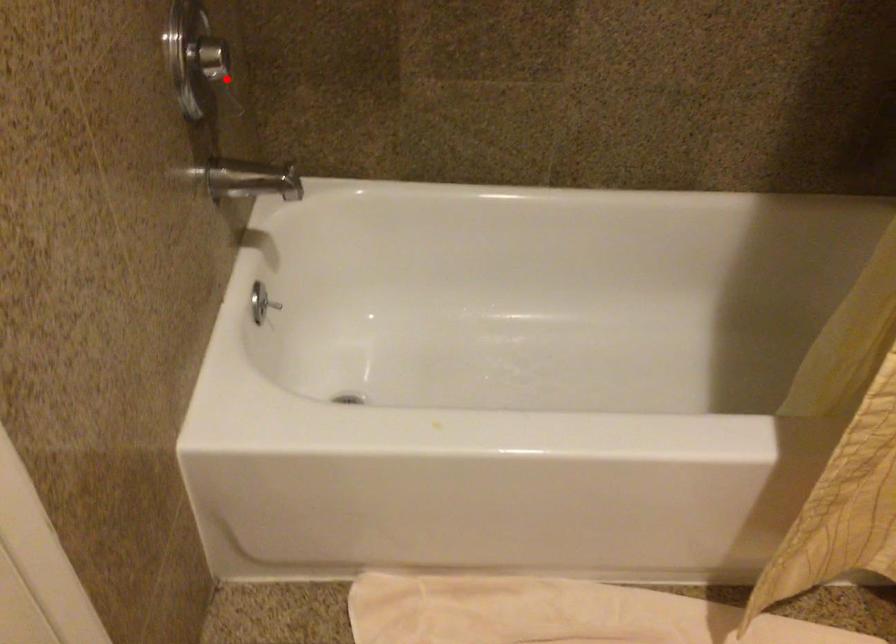
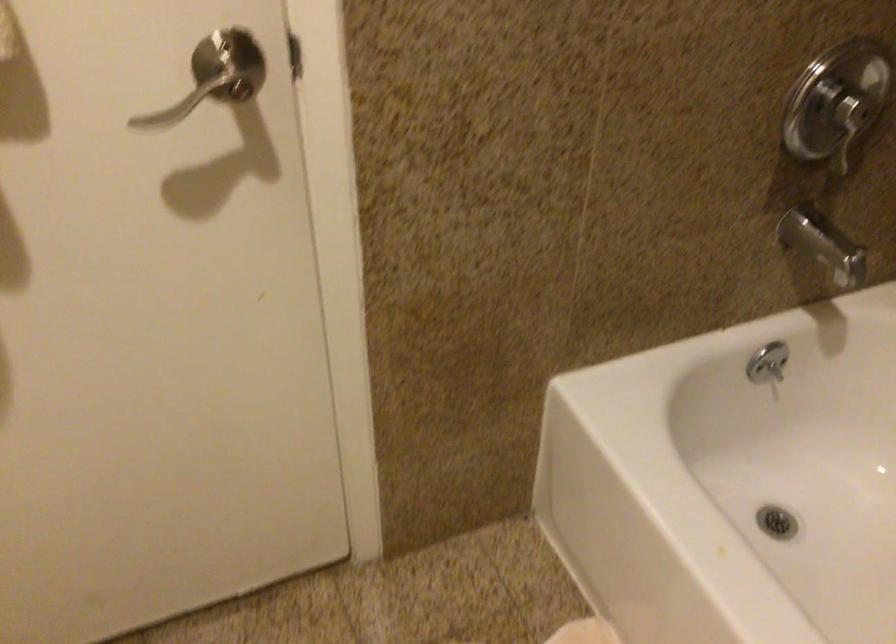
Locate, in the second image, the point that corresponds to the highlighted location in the first image.

(849, 127)